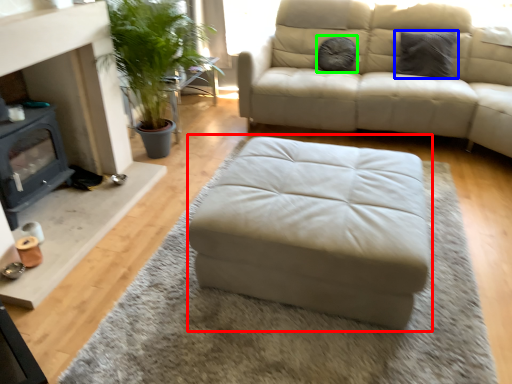
Question: Which object is the closest to the stool (highlighted by a red box)? Choose among these: pillow (highlighted by a blue box) or pillow (highlighted by a green box).

Choices:
 (A) pillow
 (B) pillow

Answer: (B)